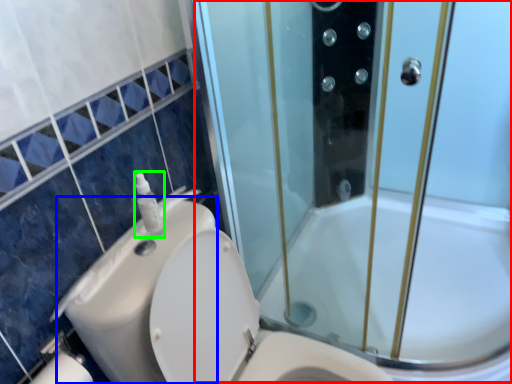
Question: Considering the real-world distances, which object is farthest from screen door (highlighted by a red box)? sink (highlighted by a blue box) or soap dispenser (highlighted by a green box)?

Choices:
 (A) sink
 (B) soap dispenser

Answer: (B)